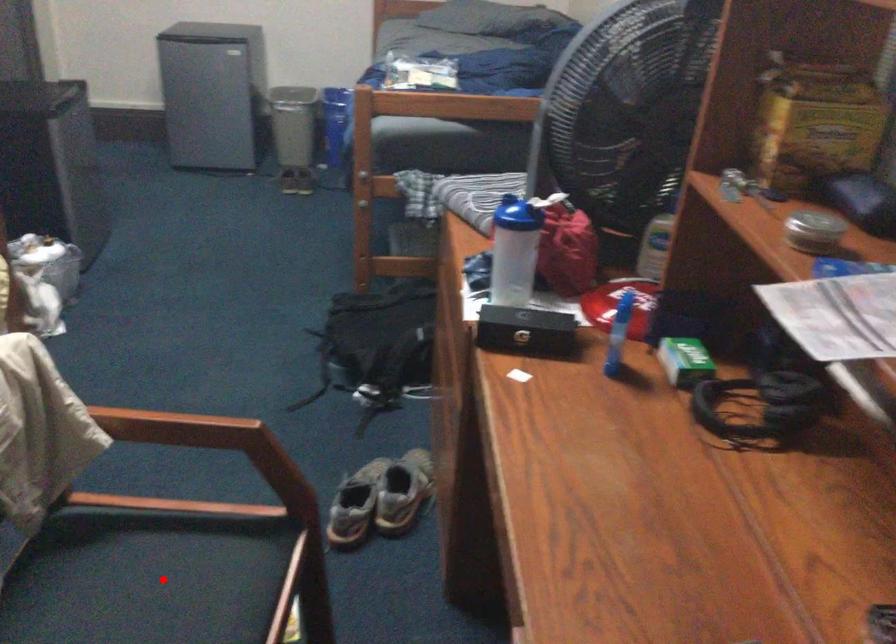
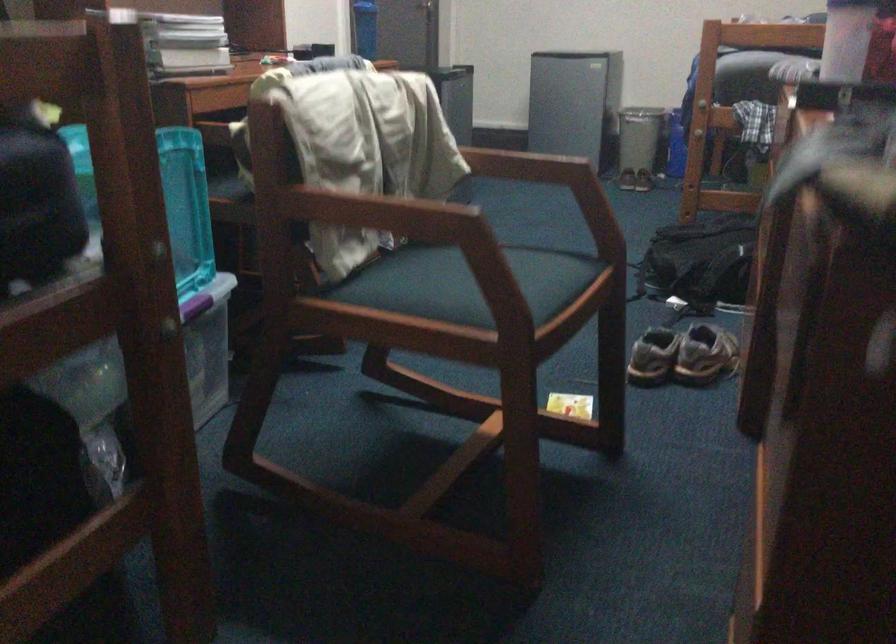
Question: I am providing you with two images of the same scene from different viewpoints. A red point is marked on the first image. At the location where the point appears in image 1, is it still visible in image 2?

Choices:
 (A) Yes
 (B) No

Answer: (B)